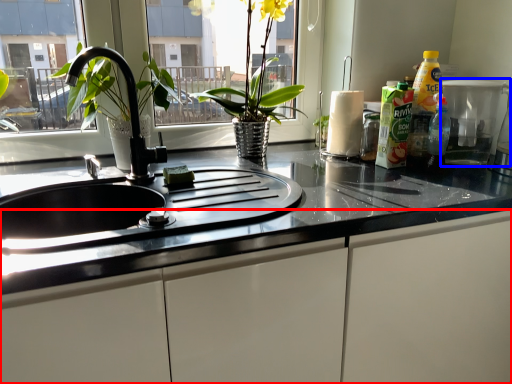
Question: Which point is closer to the camera, cabinetry (highlighted by a red box) or appliance (highlighted by a blue box)?

Choices:
 (A) cabinetry
 (B) appliance

Answer: (A)